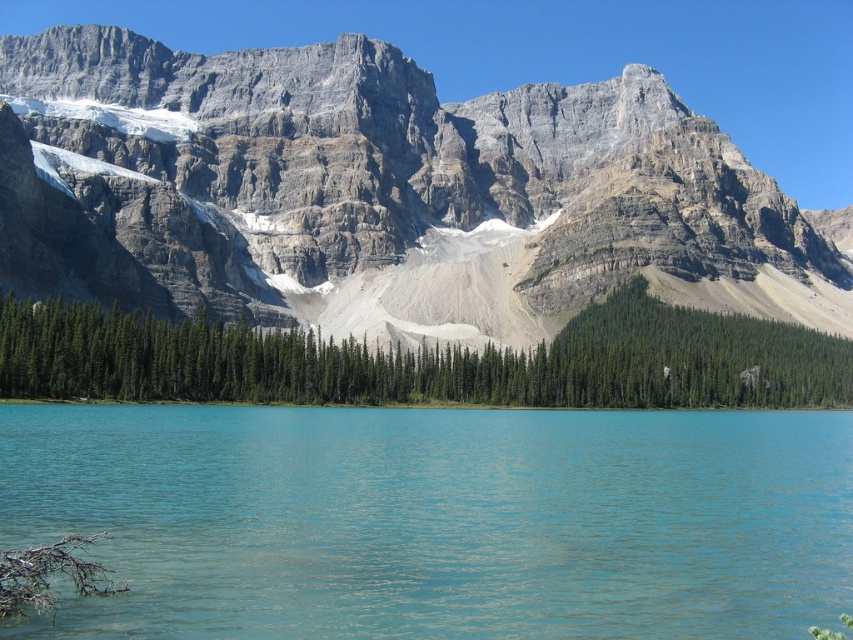
Describe the element at coordinates (381, 193) in the screenshot. This screenshot has height=640, width=853. I see `rocky gray mountain at upper center` at that location.

Is rocky gray mountain at upper center above green matte trees at center?

Indeed, rocky gray mountain at upper center is positioned over green matte trees at center.

At what (x,y) coordinates should I click in order to perform the action: click on rocky gray mountain at upper center. Please return your answer as a coordinate pair (x, y). Looking at the image, I should click on (381, 193).

Can you confirm if turquoise water at center is bigger than green matte trees at center?

Yes, turquoise water at center is bigger than green matte trees at center.

Is point (409, 465) positioned after point (781, 360)?

No, (409, 465) is in front of (781, 360).

The image size is (853, 640). I want to click on turquoise water at center, so click(436, 518).

Who is positioned more to the right, rocky gray mountain at upper center or turquoise water at center?

rocky gray mountain at upper center is more to the right.

Does rocky gray mountain at upper center appear under turquoise water at center?

No, rocky gray mountain at upper center is not below turquoise water at center.

Identify the location of rocky gray mountain at upper center. This screenshot has width=853, height=640. [x=381, y=193].